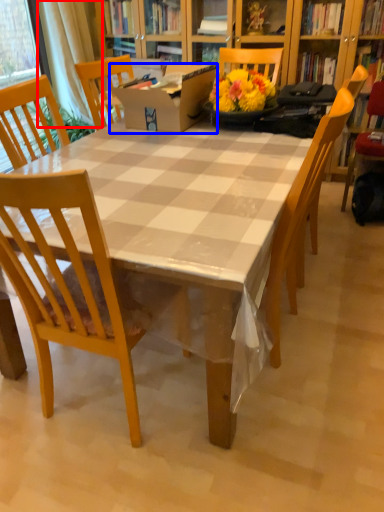
Question: Which object is closer to the camera taking this photo, curtain (highlighted by a red box) or box (highlighted by a blue box)?

Choices:
 (A) curtain
 (B) box

Answer: (B)